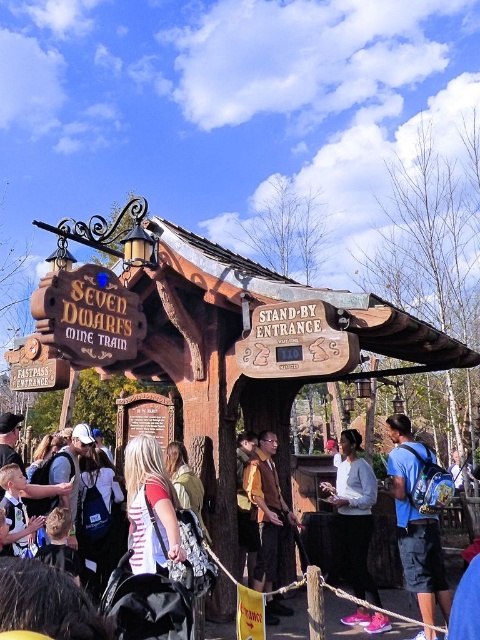
Question: Which of the following is the farthest from the observer?

Choices:
 (A) (404, 465)
 (B) (370, 618)

Answer: (B)

Question: Considering the real-world distances, which object is farthest from the wooden signpost at center?

Choices:
 (A) blue backpack at right
 (B) orange fabric shirt at center
 (C) brown suede jacket at center

Answer: (B)

Question: Considering the relative positions of wooden sign at center and brown suede jacket at center in the image provided, where is wooden sign at center located with respect to brown suede jacket at center?

Choices:
 (A) right
 (B) left

Answer: (A)

Question: Where is blue backpack at right located in relation to wooden signpost at center in the image?

Choices:
 (A) left
 (B) right

Answer: (B)

Question: Which object appears closest to the camera in this image?

Choices:
 (A) wooden signpost at center
 (B) matte black pants at center
 (C) brown suede jacket at center
 (D) blue backpack at right

Answer: (A)

Question: Does wooden sign at center have a larger size compared to blue backpack at right?

Choices:
 (A) yes
 (B) no

Answer: (B)